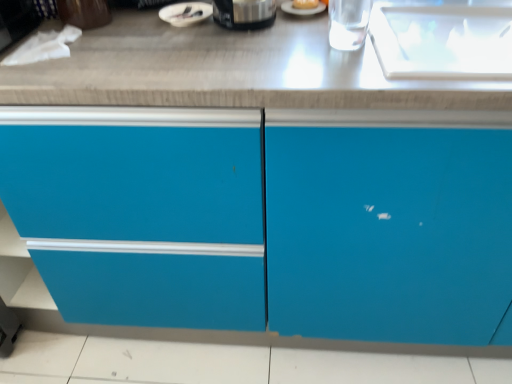
Question: Is golden bread at center situated inside matte blue cabinet at center or outside?

Choices:
 (A) outside
 (B) inside

Answer: (A)

Question: Based on their positions, is golden bread at center located to the left or right of matte blue cabinet at center?

Choices:
 (A) right
 (B) left

Answer: (B)

Question: Based on their relative distances, which object is farther from the golden bread at center?

Choices:
 (A) satin black coffee maker at upper center, the 2th appliance positioned from the left
 (B) matte blue cabinet at center
 (C) white glossy bowl at upper center, marked as the 1th appliance in a left-to-right arrangement

Answer: (B)

Question: Which object is the closest to the satin black coffee maker at upper center, the 1th appliance when ordered from right to left?

Choices:
 (A) matte blue cabinet at center
 (B) golden bread at center
 (C) white glossy bowl at upper center, placed as the 2th appliance when sorted from right to left

Answer: (C)